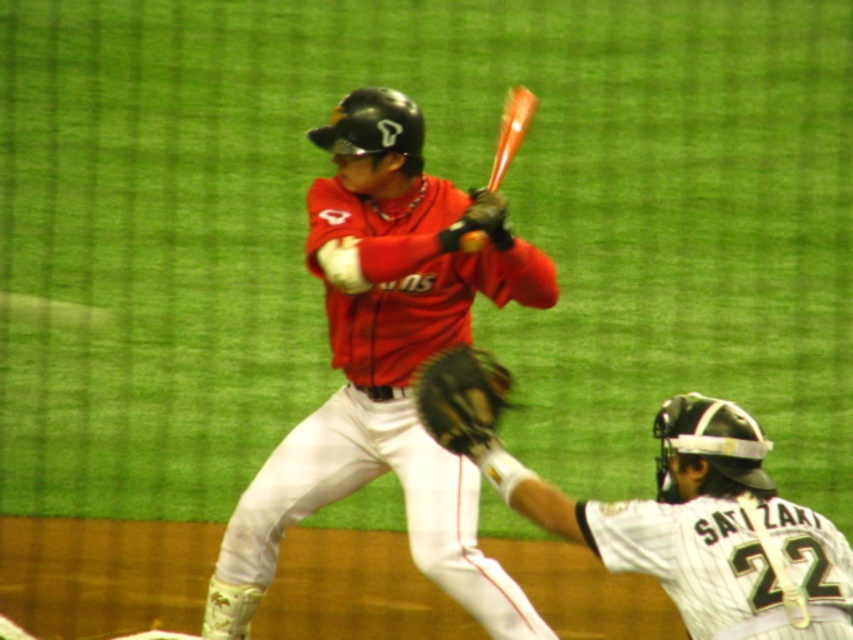
Does matte red jersey at center have a greater height compared to brown leather glove at center?

Yes, matte red jersey at center is taller than brown leather glove at center.

Which is above, matte red jersey at center or brown leather glove at center?

Positioned higher is brown leather glove at center.

Which is in front, point (316, 198) or point (498, 380)?

Point (498, 380) is more forward.

The width and height of the screenshot is (853, 640). Identify the location of matte red jersey at center. (386, 364).

Is point (236, 580) farther from viewer compared to point (506, 100)?

No, (236, 580) is closer to viewer.

Is point (376, 252) farther from camera compared to point (521, 122)?

No, (376, 252) is in front of (521, 122).

Identify the location of matte red jersey at center. (386, 364).

Does brown leather glove at center have a greater width compared to shiny orange baseball at center?

Indeed, brown leather glove at center has a greater width compared to shiny orange baseball at center.

Which is behind, point (492, 365) or point (479, 230)?

Point (479, 230)

Identify the location of brown leather glove at center. (462, 397).

The height and width of the screenshot is (640, 853). In order to click on brown leather glove at center in this screenshot , I will do `click(462, 397)`.